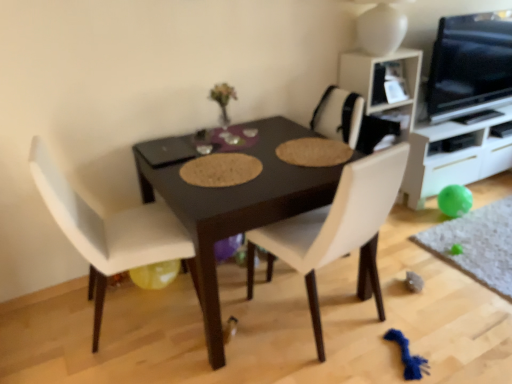
Find the location of a particular element. free space to the right of white leather chair at center, the second chair from the left is located at coordinates (428, 308).